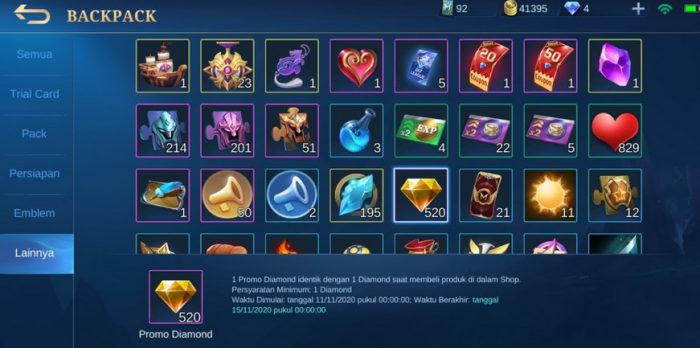
Locate an element on the screen. Image resolution: width=700 pixels, height=348 pixels. flask is located at coordinates (350, 131).